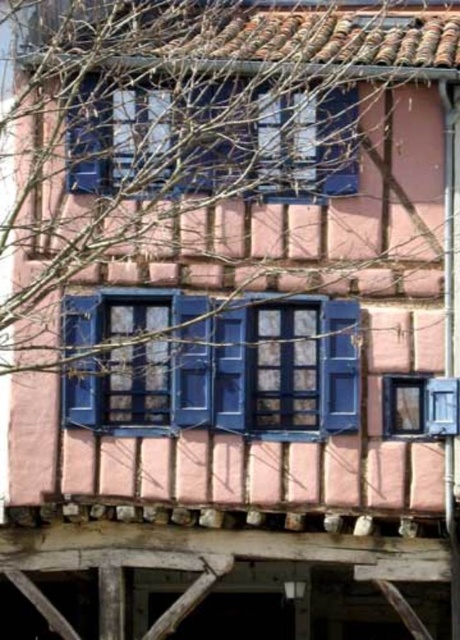
Question: Which point is farther to the camera?

Choices:
 (A) (259, 356)
 (B) (318, 100)

Answer: (A)

Question: Which point is farther to the camera?

Choices:
 (A) (230, 426)
 (B) (310, 147)

Answer: (B)

Question: Is matte blue shutters at center to the left of blue painted wood at upper center from the viewer's perspective?

Choices:
 (A) yes
 (B) no

Answer: (A)

Question: Can you confirm if matte blue shutters at center is positioned below blue painted wood at upper center?

Choices:
 (A) yes
 (B) no

Answer: (A)

Question: Can you confirm if matte blue shutters at center is smaller than blue painted wood at upper center?

Choices:
 (A) no
 (B) yes

Answer: (B)